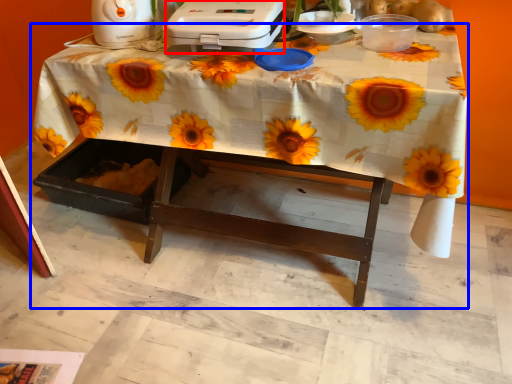
Question: Which object appears farthest to the camera in this image, appliance (highlighted by a red box) or table (highlighted by a blue box)?

Choices:
 (A) appliance
 (B) table

Answer: (A)